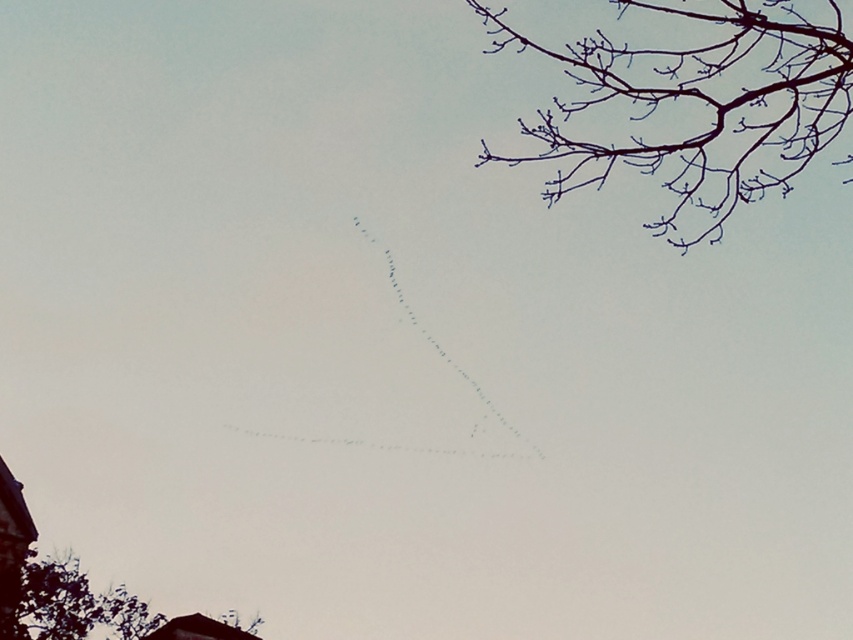
Question: Among these points, which one is farthest from the camera?

Choices:
 (A) (71, 573)
 (B) (727, 166)

Answer: (A)

Question: Is brown/dry branches at upper right closer to the viewer compared to green leafy tree at lower left?

Choices:
 (A) no
 (B) yes

Answer: (B)

Question: Can you confirm if brown/dry branches at upper right is positioned above green leafy tree at lower left?

Choices:
 (A) no
 (B) yes

Answer: (B)

Question: Can you confirm if brown/dry branches at upper right is thinner than green leafy tree at lower left?

Choices:
 (A) no
 (B) yes

Answer: (A)

Question: Among these objects, which one is nearest to the camera?

Choices:
 (A) green leafy tree at lower left
 (B) brown/dry branches at upper right

Answer: (B)

Question: Which object appears closest to the camera in this image?

Choices:
 (A) green leafy tree at lower left
 (B) brown/dry branches at upper right

Answer: (B)